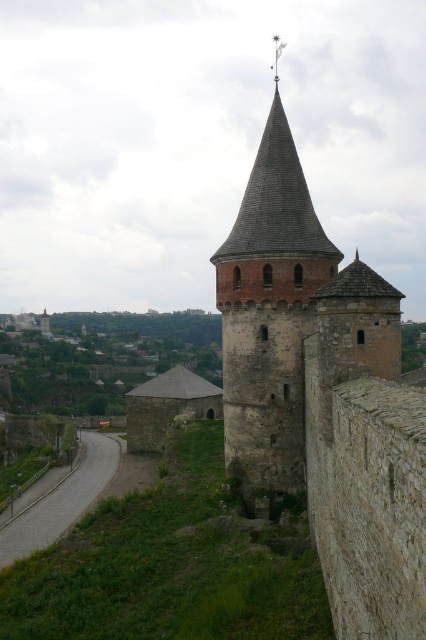
Does rustic stone tower at center appear over green grassy hillside at upper center?

Correct, rustic stone tower at center is located above green grassy hillside at upper center.

Which of these two, rustic stone tower at center or green grassy hillside at upper center, stands shorter?

Standing shorter between the two is rustic stone tower at center.

Between point (230, 474) and point (66, 413), which one is positioned behind?

Point (66, 413)

Locate an element on the screen. rustic stone tower at center is located at coordinates (270, 314).